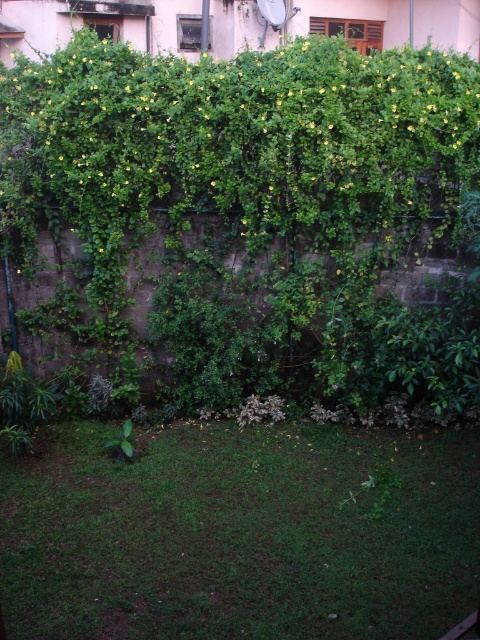
Measure the distance between green leafy hedge at upper center and green grass at lower center.

green leafy hedge at upper center is 1.59 meters from green grass at lower center.

Between green leafy hedge at upper center and green grass at lower center, which one has more height?

Standing taller between the two is green leafy hedge at upper center.

Is point (236, 84) farther from camera compared to point (140, 557)?

Yes, point (236, 84) is farther from viewer.

At what (x,y) coordinates should I click in order to perform the action: click on green leafy hedge at upper center. Please return your answer as a coordinate pair (x, y). The image size is (480, 640). Looking at the image, I should click on (250, 209).

Which is above, green leafy hedge at upper center or green leafy plant at center?

green leafy hedge at upper center

Measure the distance between green leafy hedge at upper center and camera.

green leafy hedge at upper center is 4.63 meters from camera.

Is point (300, 339) closer to viewer compared to point (130, 442)?

No, it is not.

You are a GUI agent. You are given a task and a screenshot of the screen. Output one action in this format:
    pyautogui.click(x=<x>, y=<y>)
    Task: Click on the green leafy hedge at upper center
    This screenshot has width=480, height=640.
    Given the screenshot: What is the action you would take?
    pyautogui.click(x=250, y=209)

From the picture: Does green grass at lower center appear under green leafy plant at center?

Indeed, green grass at lower center is positioned under green leafy plant at center.

This screenshot has height=640, width=480. What do you see at coordinates (241, 532) in the screenshot?
I see `green grass at lower center` at bounding box center [241, 532].

Identify the location of green grass at lower center. The height and width of the screenshot is (640, 480). (241, 532).